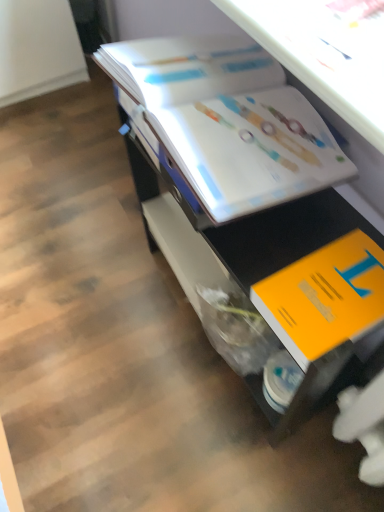
Question: Does white glossy book at upper center, which ranks as the first book in top-to-bottom order, have a greater height compared to orange matte book at lower right, positioned as the first book in bottom-to-top order?

Choices:
 (A) yes
 (B) no

Answer: (A)

Question: Considering the relative sizes of white glossy book at upper center, the second book ordered from the bottom, and orange matte book at lower right, positioned as the first book in bottom-to-top order, in the image provided, is white glossy book at upper center, the second book ordered from the bottom, smaller than orange matte book at lower right, positioned as the first book in bottom-to-top order,?

Choices:
 (A) yes
 (B) no

Answer: (B)

Question: Would you say orange matte book at lower right, positioned as the first book in bottom-to-top order, is part of white glossy book at upper center, the second book ordered from the bottom,'s contents?

Choices:
 (A) no
 (B) yes

Answer: (A)

Question: Does white glossy book at upper center, which ranks as the first book in top-to-bottom order, touch orange matte book at lower right, which appears as the second book when viewed from the top?

Choices:
 (A) yes
 (B) no

Answer: (B)

Question: Is white glossy book at upper center, which ranks as the first book in top-to-bottom order, not within orange matte book at lower right, which appears as the second book when viewed from the top?

Choices:
 (A) yes
 (B) no

Answer: (A)

Question: From the image's perspective, is orange matte book at lower right, positioned as the first book in bottom-to-top order, located above or below white glossy book at upper center, the second book ordered from the bottom?

Choices:
 (A) above
 (B) below

Answer: (B)

Question: In terms of width, does orange matte book at lower right, which appears as the second book when viewed from the top, look wider or thinner when compared to white glossy book at upper center, the second book ordered from the bottom?

Choices:
 (A) wide
 (B) thin

Answer: (B)

Question: Relative to white glossy book at upper center, the second book ordered from the bottom, is orange matte book at lower right, positioned as the first book in bottom-to-top order, in front or behind?

Choices:
 (A) front
 (B) behind

Answer: (A)

Question: Is point (306, 266) positioned closer to the camera than point (153, 72)?

Choices:
 (A) closer
 (B) farther

Answer: (A)

Question: Is white glossy book at upper center wider or thinner than white glossy book at upper center, which ranks as the first book in top-to-bottom order?

Choices:
 (A) wide
 (B) thin

Answer: (A)

Question: Do you think white glossy book at upper center is within white glossy book at upper center, which ranks as the first book in top-to-bottom order, or outside of it?

Choices:
 (A) outside
 (B) inside

Answer: (A)

Question: Is white glossy book at upper center taller or shorter than white glossy book at upper center, which ranks as the first book in top-to-bottom order?

Choices:
 (A) tall
 (B) short

Answer: (A)

Question: Visually, is white glossy book at upper center positioned to the left or to the right of white glossy book at upper center, which ranks as the first book in top-to-bottom order?

Choices:
 (A) left
 (B) right

Answer: (B)

Question: From a real-world perspective, is orange matte book at lower right, positioned as the first book in bottom-to-top order, physically located above or below white glossy book at upper center?

Choices:
 (A) above
 (B) below

Answer: (A)

Question: Is orange matte book at lower right, which appears as the second book when viewed from the top, in front of or behind white glossy book at upper center in the image?

Choices:
 (A) behind
 (B) front

Answer: (A)